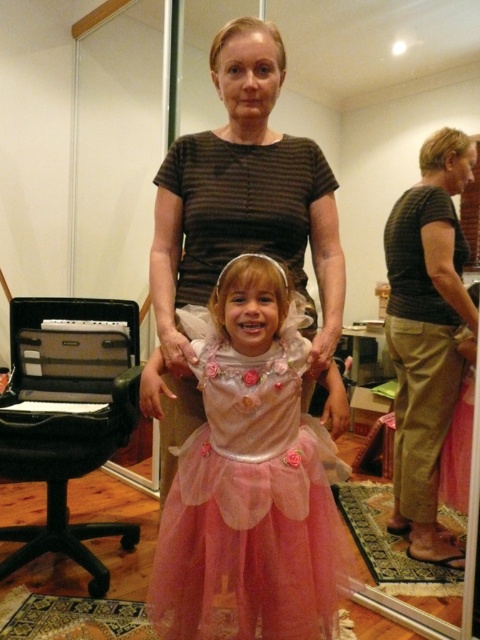
Question: Among these points, which one is nearest to the camera?

Choices:
 (A) (242, 372)
 (B) (437, 212)

Answer: (A)

Question: Which point is closer to the camera taking this photo?

Choices:
 (A) [462, 260]
 (B) [163, 570]

Answer: (B)

Question: Does pink tulle dress at center have a lesser width compared to matte brown shirt at upper right?

Choices:
 (A) no
 (B) yes

Answer: (A)

Question: Does pink tulle dress at center appear on the left side of matte brown shirt at upper right?

Choices:
 (A) yes
 (B) no

Answer: (A)

Question: Can you confirm if pink tulle dress at center is positioned below matte brown shirt at upper right?

Choices:
 (A) no
 (B) yes

Answer: (B)